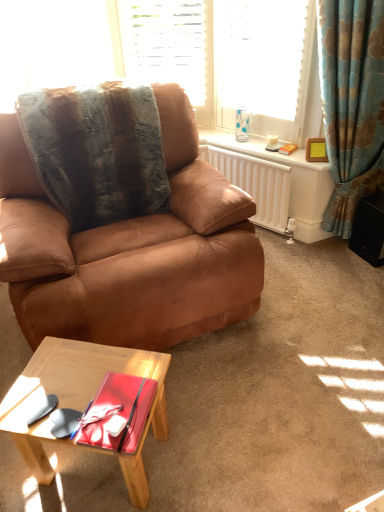
Locate an element on the screen. free spot above white matte radiator at upper right (from a real-world perspective) is located at coordinates (264, 153).